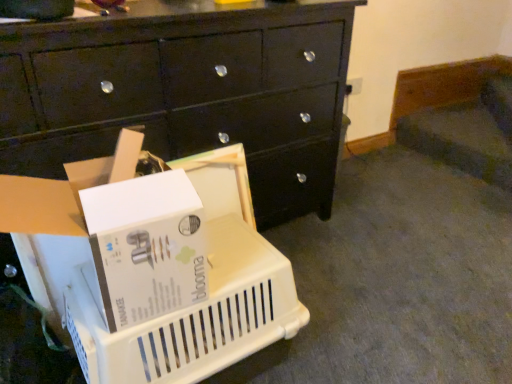
Question: Are black glossy chest of drawers at center and white plastic basket at lower left far apart?

Choices:
 (A) no
 (B) yes

Answer: (A)

Question: Does black glossy chest of drawers at center appear on the right side of white plastic basket at lower left?

Choices:
 (A) yes
 (B) no

Answer: (B)

Question: Does black glossy chest of drawers at center have a smaller size compared to white plastic basket at lower left?

Choices:
 (A) no
 (B) yes

Answer: (A)

Question: Can you confirm if black glossy chest of drawers at center is thinner than white plastic basket at lower left?

Choices:
 (A) no
 (B) yes

Answer: (A)

Question: Can you confirm if black glossy chest of drawers at center is wider than white plastic basket at lower left?

Choices:
 (A) no
 (B) yes

Answer: (B)

Question: From a real-world perspective, relative to white plastic storage box at lower left, is white plastic basket at lower left vertically above or below?

Choices:
 (A) below
 (B) above

Answer: (A)

Question: Considering the positions of white plastic basket at lower left and white plastic storage box at lower left in the image, is white plastic basket at lower left bigger or smaller than white plastic storage box at lower left?

Choices:
 (A) big
 (B) small

Answer: (A)

Question: Is white plastic basket at lower left wider or thinner than white plastic storage box at lower left?

Choices:
 (A) thin
 (B) wide

Answer: (B)

Question: Considering the relative positions of white plastic basket at lower left and white plastic storage box at lower left in the image provided, is white plastic basket at lower left to the left or to the right of white plastic storage box at lower left?

Choices:
 (A) right
 (B) left

Answer: (A)

Question: Choose the correct answer: Is black glossy chest of drawers at center inside white plastic storage box at lower left or outside it?

Choices:
 (A) outside
 (B) inside

Answer: (A)

Question: In the image, is black glossy chest of drawers at center positioned in front of or behind white plastic storage box at lower left?

Choices:
 (A) front
 (B) behind

Answer: (B)

Question: Considering the positions of black glossy chest of drawers at center and white plastic storage box at lower left in the image, is black glossy chest of drawers at center taller or shorter than white plastic storage box at lower left?

Choices:
 (A) short
 (B) tall

Answer: (B)

Question: Is black glossy chest of drawers at center wider or thinner than white plastic storage box at lower left?

Choices:
 (A) wide
 (B) thin

Answer: (A)

Question: From the image's perspective, relative to white plastic basket at lower left, is black glossy chest of drawers at center above or below?

Choices:
 (A) below
 (B) above

Answer: (B)

Question: From a real-world perspective, is black glossy chest of drawers at center physically located above or below white plastic basket at lower left?

Choices:
 (A) above
 (B) below

Answer: (A)